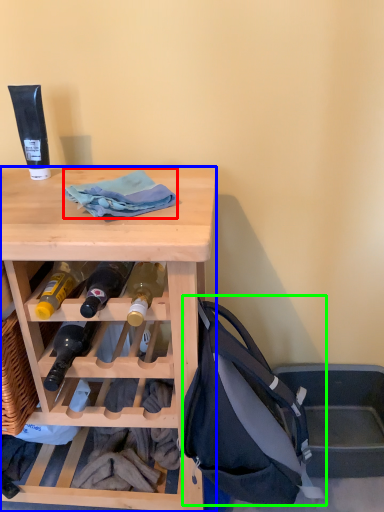
Question: Based on their relative distances, which object is nearer to cloth (highlighted by a red box)? Choose from desk (highlighted by a blue box) and handbag (highlighted by a green box).

Choices:
 (A) desk
 (B) handbag

Answer: (A)